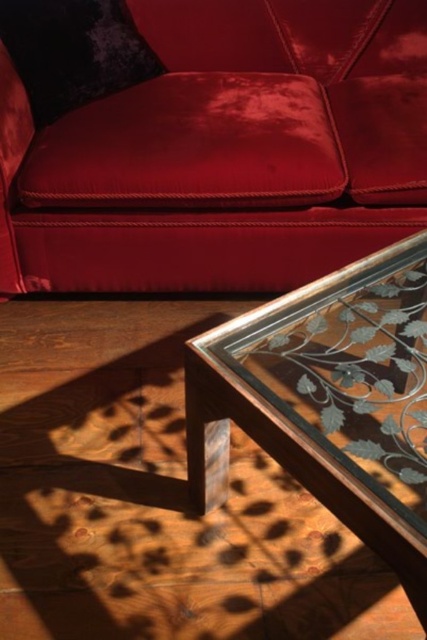
You are arranging flowers in the living room and want to place a vase on the clear glass table at center. To ensure the velvet red couch at upper center is visible from the table, should you place the vase on the left or right side of the table?

The velvet red couch at upper center is to the left of clear glass table at center, so placing the vase on the right side of the table would keep the couch visible from the table.

You are a guest in this room and want to place a heavy book on the clear glass table at center. However, the velvet red couch at upper center is blocking your path. Can you move the couch to access the table?

The velvet red couch at upper center is positioned over clear glass table at center, so moving the couch would require removing it from above the table to access the table.